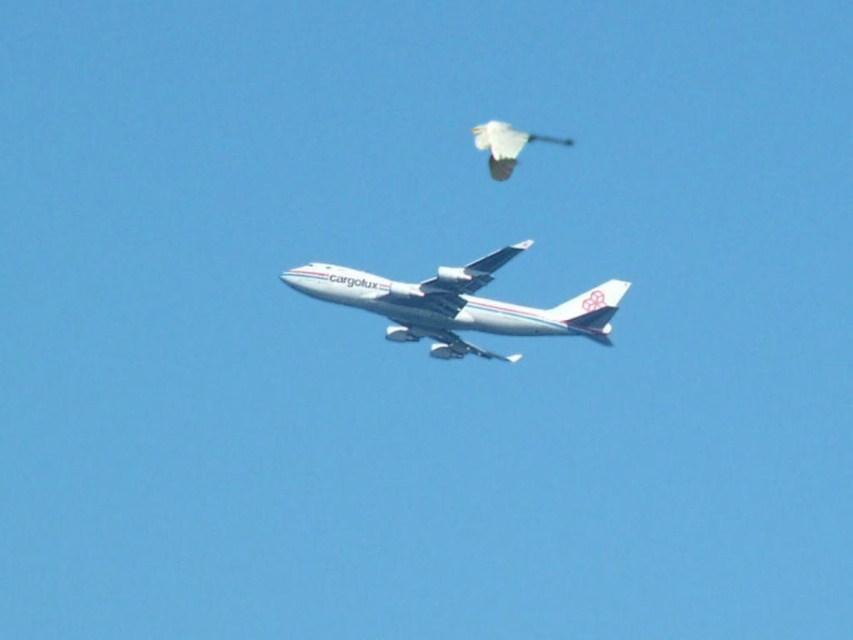
You are a pilot flying a small single engine plane. You notice two objects in the sky ahead of you. One is the white glossy airplane at center and the other is the white matte bird at upper center. Which object should you be more cautious of avoiding due to its size?

The white glossy airplane at center is bigger than the white matte bird at upper center, so you should be more cautious of avoiding the white glossy airplane at center because it poses a greater collision risk due to its larger size.

You are a pilot flying a small plane and you see the white glossy airplane at center and the white matte bird at upper center in the sky. Which object is nearer to your cockpit? Please explain your reasoning based on their positions.

The white glossy airplane at center is closer to the viewer than the white matte bird at upper center, so the white glossy airplane at center is nearer to your cockpit.

You are a pilot flying a small plane that needs to avoid collisions. You observe the white glossy airplane at center and the white matte bird at upper center. Which object is wider, potentially posing a greater collision risk?

The white glossy airplane at center is wider than the white matte bird at upper center, so it poses a greater collision risk.